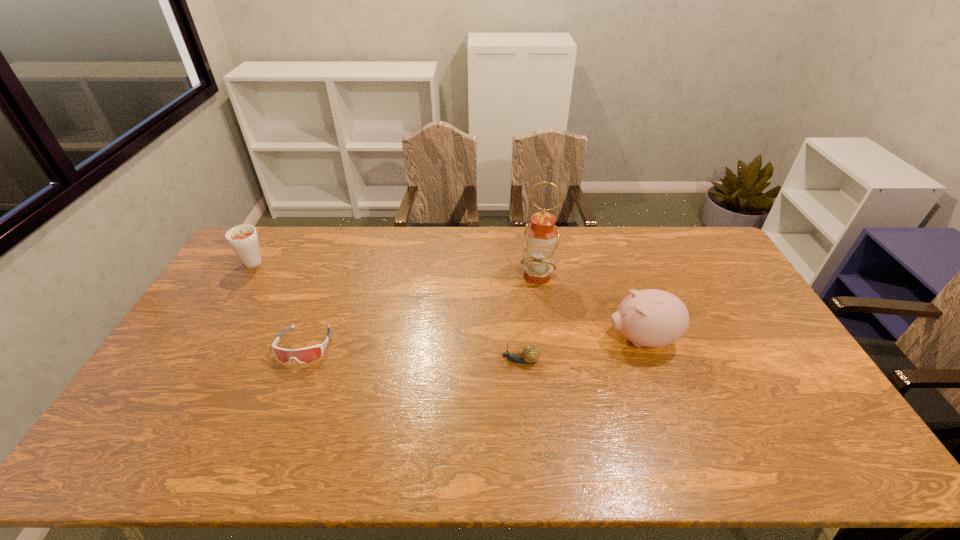
Locate an element on the screen. The width and height of the screenshot is (960, 540). vacant space in between the rightmost object and the goggles is located at coordinates (473, 342).

The width and height of the screenshot is (960, 540). What are the coordinates of `object that is the second closest one to the escargot` in the screenshot? It's located at (541, 237).

Select which object is the second closest to the leftmost object. Please provide its 2D coordinates. Your answer should be formatted as a tuple, i.e. [(x, y)], where the tuple contains the x and y coordinates of a point satisfying the conditions above.

[(529, 354)]

What are the coordinates of `free spot that satisfies the following two spatial constraints: 1. at the snout of the piggy bank; 2. on the front-facing side of the second object from left to right` in the screenshot? It's located at (644, 346).

Locate an element on the screen. The width and height of the screenshot is (960, 540). free spot that satisfies the following two spatial constraints: 1. on the drink side of the leftmost object; 2. on the left side of the tallest object is located at coordinates (246, 276).

At what (x,y) coordinates should I click in order to perform the action: click on vacant area that satisfies the following two spatial constraints: 1. at the snout of the rightmost object; 2. on the front-facing side of the goggles. Please return your answer as a coordinate pair (x, y). Looking at the image, I should click on (644, 346).

Where is `vacant space that satisfies the following two spatial constraints: 1. at the snout of the rightmost object; 2. on the front-facing side of the fourth object from right to left`? Image resolution: width=960 pixels, height=540 pixels. vacant space that satisfies the following two spatial constraints: 1. at the snout of the rightmost object; 2. on the front-facing side of the fourth object from right to left is located at coordinates (644, 346).